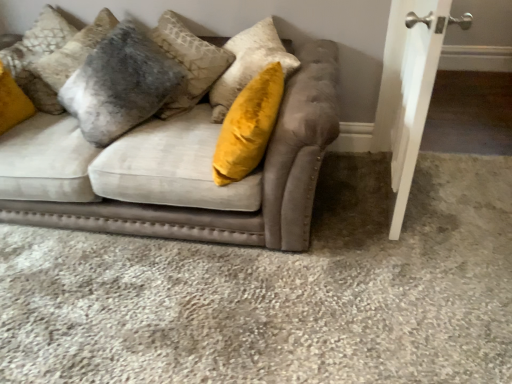
Question: Is white smooth door at right shorter than velvet gray pillow at upper left?

Choices:
 (A) yes
 (B) no

Answer: (B)

Question: Does white smooth door at right contain velvet gray pillow at upper left?

Choices:
 (A) yes
 (B) no

Answer: (B)

Question: Is white smooth door at right taller than velvet gray pillow at upper left?

Choices:
 (A) yes
 (B) no

Answer: (A)

Question: From the image's perspective, would you say white smooth door at right is shown under velvet gray pillow at upper left?

Choices:
 (A) yes
 (B) no

Answer: (A)

Question: Can you confirm if white smooth door at right is thinner than velvet gray pillow at upper left?

Choices:
 (A) yes
 (B) no

Answer: (A)

Question: Considering the relative positions of white smooth door at right and velvet beige couch at center in the image provided, is white smooth door at right to the left or to the right of velvet beige couch at center?

Choices:
 (A) left
 (B) right

Answer: (B)

Question: From the image's perspective, is white smooth door at right above or below velvet beige couch at center?

Choices:
 (A) below
 (B) above

Answer: (B)

Question: Is white smooth door at right wider or thinner than velvet beige couch at center?

Choices:
 (A) thin
 (B) wide

Answer: (A)

Question: Is white smooth door at right taller or shorter than velvet beige couch at center?

Choices:
 (A) short
 (B) tall

Answer: (B)

Question: Is point (182, 187) positioned closer to the camera than point (62, 54)?

Choices:
 (A) closer
 (B) farther

Answer: (A)

Question: Is velvet beige couch at center taller or shorter than velvet gray pillow at upper left?

Choices:
 (A) short
 (B) tall

Answer: (A)

Question: From the image's perspective, relative to velvet gray pillow at upper left, is velvet beige couch at center above or below?

Choices:
 (A) below
 (B) above

Answer: (A)

Question: Looking at the image, does velvet beige couch at center seem bigger or smaller compared to velvet gray pillow at upper left?

Choices:
 (A) small
 (B) big

Answer: (B)

Question: Relative to white smooth door at right, is velvet gray pillow at upper left in front or behind?

Choices:
 (A) front
 (B) behind

Answer: (B)

Question: Is velvet gray pillow at upper left taller or shorter than white smooth door at right?

Choices:
 (A) tall
 (B) short

Answer: (B)